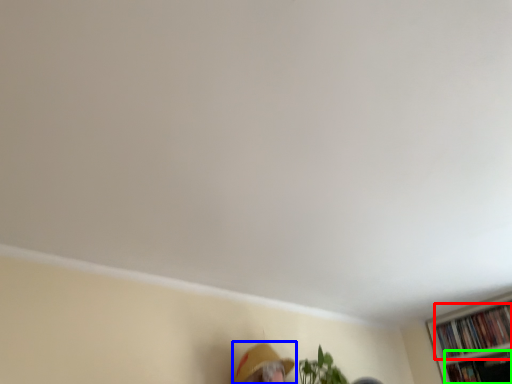
Question: Which is nearer to the book (highlighted by a red box)? person (highlighted by a blue box) or book (highlighted by a green box).

Choices:
 (A) person
 (B) book

Answer: (B)